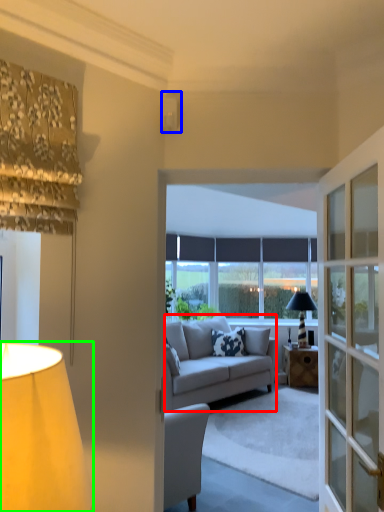
Question: Considering the real-world distances, which object is farthest from studio couch (highlighted by a red box)? lamp (highlighted by a blue box) or lamp (highlighted by a green box)?

Choices:
 (A) lamp
 (B) lamp

Answer: (B)